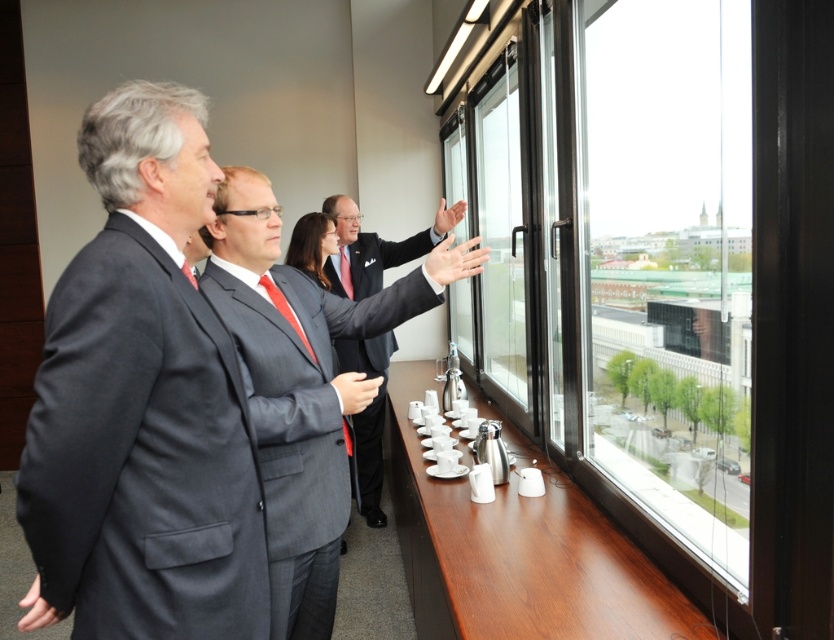
You are standing in the room and want to locate the dark gray suit at left. What are the coordinates where you can find it?

The dark gray suit at left can be found at coordinates point (142,403).